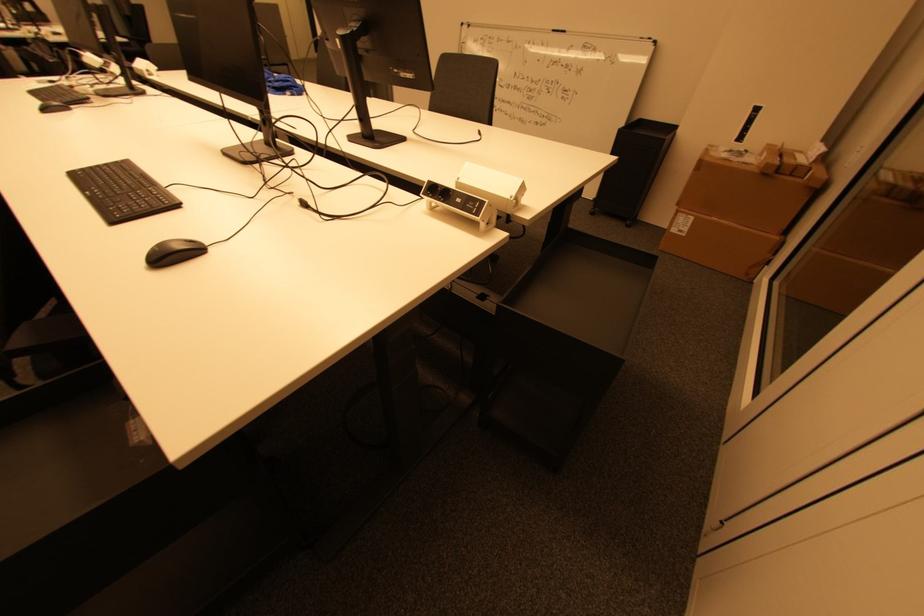
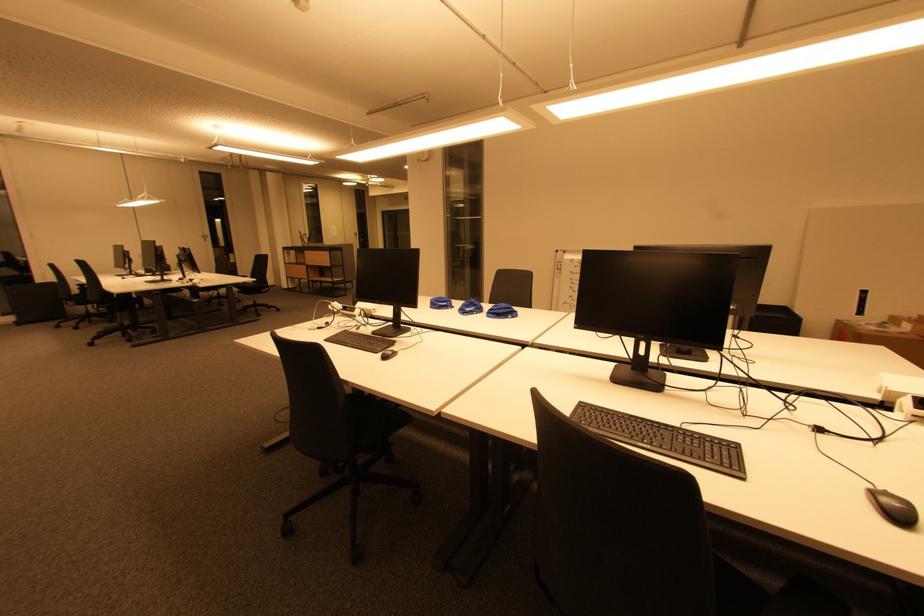
Question: What movement of the cameraman would produce the second image?

Choices:
 (A) Left
 (B) Right
 (C) Forward
 (D) Backward

Answer: (A)